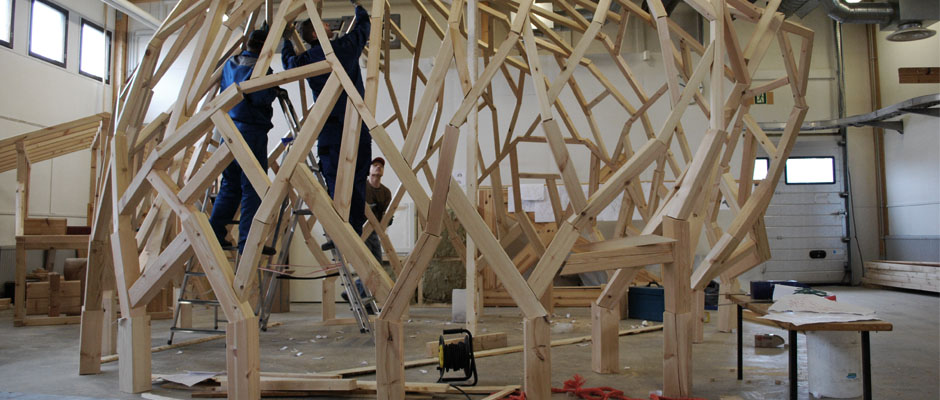
The height and width of the screenshot is (400, 940). Find the location of `black table legs`. black table legs is located at coordinates (864, 372), (793, 372), (742, 346).